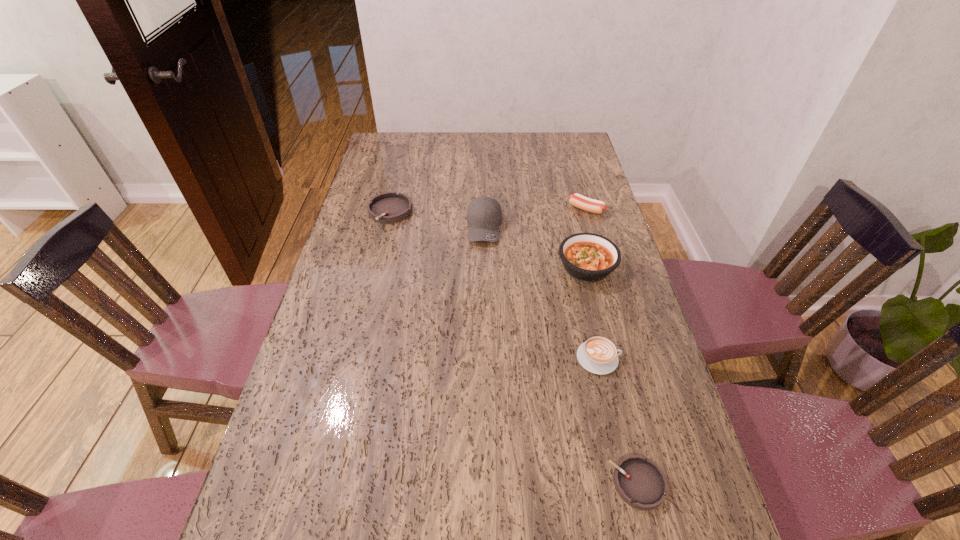
This screenshot has width=960, height=540. What are the coordinates of `sausage that is positioned at the right edge` in the screenshot? It's located at (591, 205).

The width and height of the screenshot is (960, 540). I want to click on cappuccino positioned at the right edge, so click(598, 355).

In order to click on object that is at the near right corner in this screenshot , I will do `click(640, 482)`.

Image resolution: width=960 pixels, height=540 pixels. Identify the location of vacant space at the far edge of the desktop. pos(465,158).

Find the location of a particular element. This screenshot has height=540, width=960. free location at the near edge is located at coordinates (558, 523).

Identify the location of free location at the left edge of the desktop. This screenshot has width=960, height=540. (300, 481).

In the image, there is a desktop. Where is `vacant space at the right edge`? vacant space at the right edge is located at coordinates (593, 330).

In the image, there is a desktop. Where is `vacant area at the far left corner`? vacant area at the far left corner is located at coordinates (372, 153).

Locate an element on the screen. The width and height of the screenshot is (960, 540). vacant point located between the fifth object from right to left and the second nearest object is located at coordinates (541, 293).

Identify the location of free spot between the sausage and the tallest object. This screenshot has height=540, width=960. (536, 218).